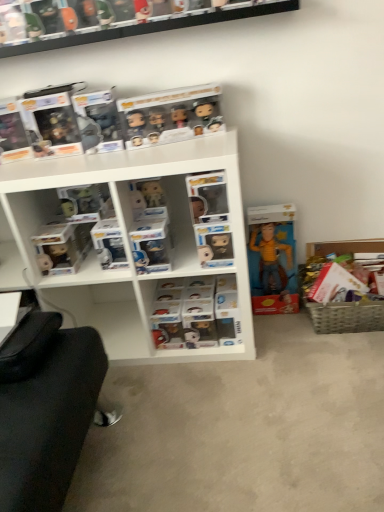
What do you see at coordinates (85, 201) in the screenshot? I see `matte black figurine at left, which is the 1th toy from left to right` at bounding box center [85, 201].

In order to face matte black figurine at left, which is the 1th toy from left to right, should I rotate leftwards or rightwards?

A 14.228 degree turn to the left will do.

What do you see at coordinates (272, 257) in the screenshot? I see `yellow fabric doll at center, which appears as the 2th toy when viewed from the left` at bounding box center [272, 257].

In order to click on clear plastic figurines at upper center, the 2th shelf positioned from the bottom in this screenshot , I will do (147, 28).

Locate an element on the screen. This screenshot has width=384, height=512. white plastic shelf at center, which appears as the first shelf when ordered from the bottom is located at coordinates (129, 241).

Which of these two, yellow fabric doll at center, the first toy positioned from the right, or matte black figurine at left, which is the 1th toy from left to right, stands taller?

Standing taller between the two is yellow fabric doll at center, the first toy positioned from the right.

Is yellow fabric doll at center, which appears as the 2th toy when viewed from the left, turned away from matte black figurine at left, which is the 1th toy from left to right?

No, yellow fabric doll at center, which appears as the 2th toy when viewed from the left, is not facing the opposite direction of matte black figurine at left, which is the 1th toy from left to right.

Who is shorter, yellow fabric doll at center, the first toy positioned from the right, or woven basket at lower right?

With less height is woven basket at lower right.

From the image's perspective, between yellow fabric doll at center, the first toy positioned from the right, and woven basket at lower right, who is located below?

woven basket at lower right is shown below in the image.

Which is in front, point (268, 252) or point (313, 319)?

The point (313, 319) is more forward.

The image size is (384, 512). Find the location of `cabinet located underneath the yellow fabric doll at center, which appears as the 2th toy when viewed from the left (from a real-world perspective)`. cabinet located underneath the yellow fabric doll at center, which appears as the 2th toy when viewed from the left (from a real-world perspective) is located at coordinates [346, 317].

Based on the photo, from a real-world perspective, is white plastic shelf at center, the second shelf in the top-to-bottom sequence, located higher than yellow fabric doll at center, the first toy positioned from the right?

Yes.

From the image's perspective, is white plastic shelf at center, which appears as the first shelf when ordered from the bottom, over yellow fabric doll at center, the first toy positioned from the right?

Yes, from the image's perspective, white plastic shelf at center, which appears as the first shelf when ordered from the bottom, is above yellow fabric doll at center, the first toy positioned from the right.

Is point (51, 206) closer to camera compared to point (270, 244)?

Yes, it is.

Considering the relative sizes of white plastic shelf at center, the second shelf in the top-to-bottom sequence, and yellow fabric doll at center, which appears as the 2th toy when viewed from the left, in the image provided, is white plastic shelf at center, the second shelf in the top-to-bottom sequence, thinner than yellow fabric doll at center, which appears as the 2th toy when viewed from the left,?

Incorrect, the width of white plastic shelf at center, the second shelf in the top-to-bottom sequence, is not less than that of yellow fabric doll at center, which appears as the 2th toy when viewed from the left.

Considering the relative sizes of clear plastic figurines at upper center, the 2th shelf positioned from the bottom, and clear plastic figures at center in the image provided, is clear plastic figurines at upper center, the 2th shelf positioned from the bottom, thinner than clear plastic figures at center?

Correct, the width of clear plastic figurines at upper center, the 2th shelf positioned from the bottom, is less than that of clear plastic figures at center.

Is the surface of clear plastic figurines at upper center, which is the 1th shelf from top to bottom, in direct contact with clear plastic figures at center?

No, clear plastic figurines at upper center, which is the 1th shelf from top to bottom, is not making contact with clear plastic figures at center.

Based on the photo, between clear plastic figurines at upper center, which is the 1th shelf from top to bottom, and clear plastic figures at center, which one has more height?

clear plastic figures at center is taller.

From a real-world perspective, is clear plastic figurines at upper center, the 2th shelf positioned from the bottom, physically above clear plastic figures at center?

Yes, from a real-world perspective, clear plastic figurines at upper center, the 2th shelf positioned from the bottom, is over clear plastic figures at center

Does point (221, 150) come farther from viewer compared to point (73, 196)?

No, (221, 150) is closer to viewer.

Which object is positioned more to the left, white plastic shelf at center, the second shelf in the top-to-bottom sequence, or matte black figurine at left, which is the 1th toy from left to right?

matte black figurine at left, which is the 1th toy from left to right.

Is white plastic shelf at center, which appears as the first shelf when ordered from the bottom, oriented away from matte black figurine at left, which is the 1th toy from left to right?

Yes, white plastic shelf at center, which appears as the first shelf when ordered from the bottom, is positioned with its back facing matte black figurine at left, which is the 1th toy from left to right.

Who is taller, clear plastic figurines at upper center, the 2th shelf positioned from the bottom, or yellow fabric doll at center, the first toy positioned from the right?

Standing taller between the two is yellow fabric doll at center, the first toy positioned from the right.

Considering the sizes of objects clear plastic figurines at upper center, which is the 1th shelf from top to bottom, and yellow fabric doll at center, the first toy positioned from the right, in the image provided, who is wider, clear plastic figurines at upper center, which is the 1th shelf from top to bottom, or yellow fabric doll at center, the first toy positioned from the right,?

clear plastic figurines at upper center, which is the 1th shelf from top to bottom, is wider.

Measure the distance from clear plastic figurines at upper center, the 2th shelf positioned from the bottom, to yellow fabric doll at center, which appears as the 2th toy when viewed from the left.

clear plastic figurines at upper center, the 2th shelf positioned from the bottom, and yellow fabric doll at center, which appears as the 2th toy when viewed from the left, are 33.98 inches apart from each other.

Is clear plastic figurines at upper center, which is the 1th shelf from top to bottom, positioned far away from yellow fabric doll at center, which appears as the 2th toy when viewed from the left?

That's not correct — clear plastic figurines at upper center, which is the 1th shelf from top to bottom, is a little close to yellow fabric doll at center, which appears as the 2th toy when viewed from the left.

Is point (189, 340) in front of point (117, 35)?

No, it is behind (117, 35).

Considering the sizes of objects clear plastic figures at center and clear plastic figurines at upper center, the 2th shelf positioned from the bottom, in the image provided, who is shorter, clear plastic figures at center or clear plastic figurines at upper center, the 2th shelf positioned from the bottom,?

clear plastic figurines at upper center, the 2th shelf positioned from the bottom.

Measure the distance from clear plastic figures at center to clear plastic figurines at upper center, the 2th shelf positioned from the bottom.

clear plastic figures at center is 38.51 inches from clear plastic figurines at upper center, the 2th shelf positioned from the bottom.

Where is `toy behind the matte black figurine at left, which is the 1th toy from left to right`? toy behind the matte black figurine at left, which is the 1th toy from left to right is located at coordinates (272, 257).

The width and height of the screenshot is (384, 512). What are the coordinates of `cabinet to the right of yellow fabric doll at center, which appears as the 2th toy when viewed from the left` in the screenshot? It's located at (346, 317).

From the image, which object appears to be nearer to clear plastic figurines at upper center, which is the 1th shelf from top to bottom, matte black figurine at left, which is the 1th toy from left to right, or yellow fabric doll at center, which appears as the 2th toy when viewed from the left?

Among the two, matte black figurine at left, which is the 1th toy from left to right, is located nearer to clear plastic figurines at upper center, which is the 1th shelf from top to bottom.

Consider the image. From the image, which object appears to be farther from clear plastic figures at center, matte black figurine at left, positioned as the 2th toy in right-to-left order, or yellow fabric doll at center, which appears as the 2th toy when viewed from the left?

matte black figurine at left, positioned as the 2th toy in right-to-left order, lies further to clear plastic figures at center than the other object.

When comparing their distances from matte black figurine at left, which is the 1th toy from left to right, does white plastic shelf at center, which appears as the first shelf when ordered from the bottom, or yellow fabric doll at center, which appears as the 2th toy when viewed from the left, seem closer?

white plastic shelf at center, which appears as the first shelf when ordered from the bottom, is positioned closer to the anchor matte black figurine at left, which is the 1th toy from left to right.

Based on their spatial positions, is white plastic shelf at center, which appears as the first shelf when ordered from the bottom, or woven basket at lower right closer to clear plastic figurines at upper center, which is the 1th shelf from top to bottom?

Among the two, white plastic shelf at center, which appears as the first shelf when ordered from the bottom, is located nearer to clear plastic figurines at upper center, which is the 1th shelf from top to bottom.

Which object lies nearer to the anchor point matte black figurine at left, which is the 1th toy from left to right, woven basket at lower right or white plastic shelf at center, which appears as the first shelf when ordered from the bottom?

white plastic shelf at center, which appears as the first shelf when ordered from the bottom, is closer to matte black figurine at left, which is the 1th toy from left to right.

Estimate the real-world distances between objects in this image. Which object is further from woven basket at lower right, yellow fabric doll at center, which appears as the 2th toy when viewed from the left, or clear plastic figures at center?

clear plastic figures at center is positioned further to the anchor woven basket at lower right.

From the image, which object appears to be nearer to yellow fabric doll at center, which appears as the 2th toy when viewed from the left, matte black figurine at left, which is the 1th toy from left to right, or woven basket at lower right?

woven basket at lower right is closer to yellow fabric doll at center, which appears as the 2th toy when viewed from the left.

Based on their spatial positions, is yellow fabric doll at center, which appears as the 2th toy when viewed from the left, or matte black figurine at left, positioned as the 2th toy in right-to-left order, further from clear plastic figures at center?

Based on the image, matte black figurine at left, positioned as the 2th toy in right-to-left order, appears to be further to clear plastic figures at center.

At what (x,y) coordinates should I click in order to perform the action: click on toy between clear plastic figurines at upper center, the 2th shelf positioned from the bottom, and yellow fabric doll at center, the first toy positioned from the right, in the up-down direction. Please return your answer as a coordinate pair (x, y). Looking at the image, I should click on (85, 201).

I want to click on book between white plastic shelf at center, which appears as the first shelf when ordered from the bottom, and yellow fabric doll at center, the first toy positioned from the right, so click(x=197, y=313).

Locate an element on the screen. The height and width of the screenshot is (512, 384). toy between matte black figurine at left, which is the 1th toy from left to right, and woven basket at lower right is located at coordinates (272, 257).

Identify the location of shelf that lies between clear plastic figurines at upper center, which is the 1th shelf from top to bottom, and clear plastic figures at center from top to bottom. The width and height of the screenshot is (384, 512). (129, 241).